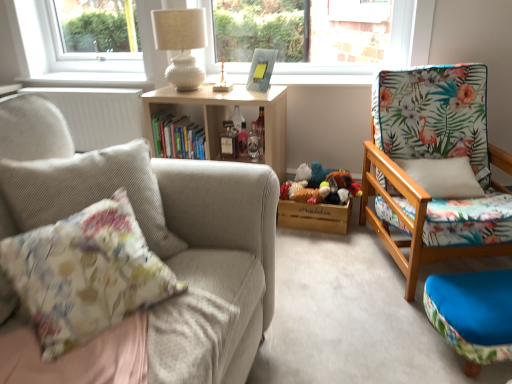
The width and height of the screenshot is (512, 384). In order to click on free space in front of translucent glass figurine at upper center in this screenshot , I will do `click(226, 94)`.